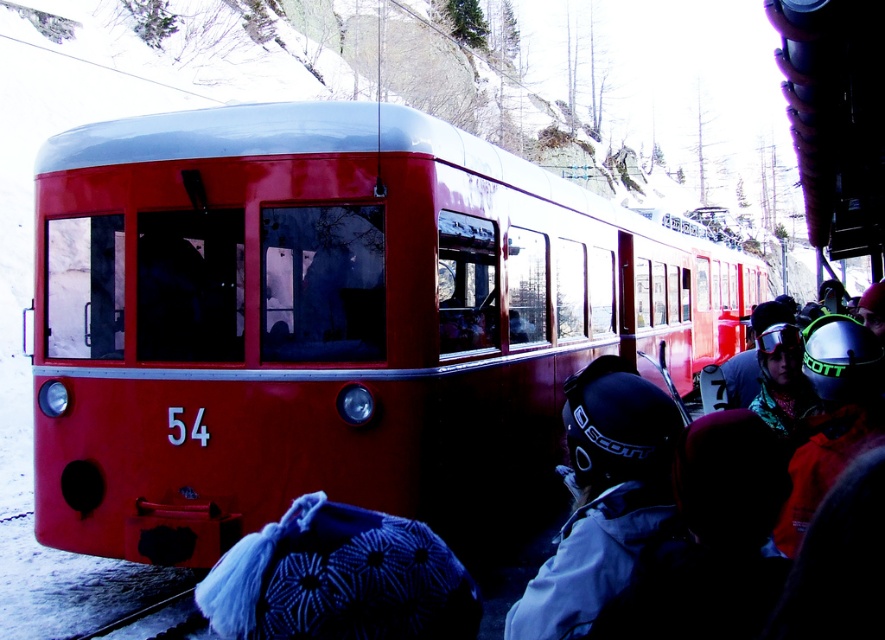
Between point (204, 224) and point (566, 524), which one is positioned behind?

Positioned behind is point (566, 524).

Is shiny red train at center behind matte black helmet at center?

Yes, it is.

Who is more distant from viewer, (301, 320) or (663, 396)?

The point (301, 320) is behind.

Find the location of `shiny red train at center`. shiny red train at center is located at coordinates (325, 317).